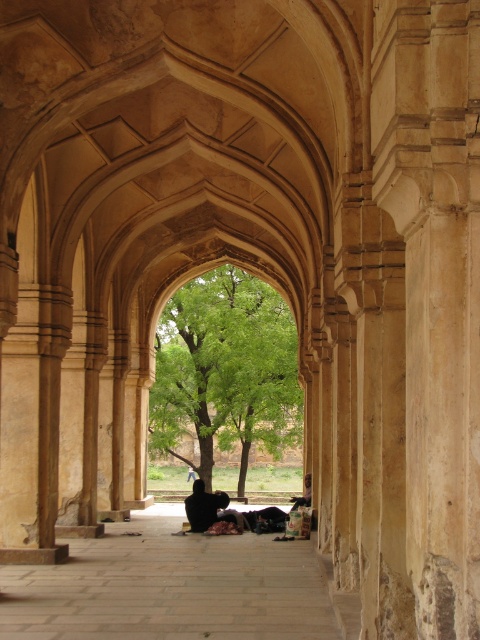
You are an interior designer planning to place a large decorative item in the space between the green leafy tree at center and the dark brown fabric at center. Based on their sizes, which object should you consider moving to make space?

The green leafy tree at center is bigger than the dark brown fabric at center, so you should consider moving the dark brown fabric at center to make space for the large decorative item.